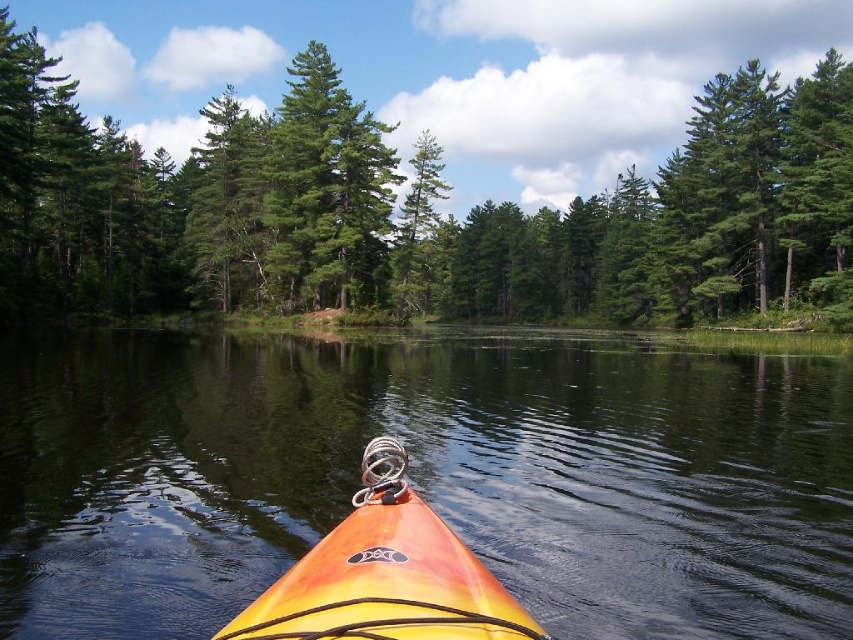
Question: Which point is closer to the camera?

Choices:
 (A) green matte tree at center
 (B) transparent water at center
 (C) orange matte kayak at center

Answer: (C)

Question: Does green matte tree at center appear over orange matte kayak at center?

Choices:
 (A) no
 (B) yes

Answer: (B)

Question: Can you confirm if transparent water at center is bigger than orange matte kayak at center?

Choices:
 (A) no
 (B) yes

Answer: (B)

Question: Does transparent water at center appear over orange matte kayak at center?

Choices:
 (A) yes
 (B) no

Answer: (B)

Question: Which of the following is the closest to the observer?

Choices:
 (A) green matte tree at center
 (B) transparent water at center
 (C) orange matte kayak at center

Answer: (C)

Question: Which is nearer to the orange matte kayak at center?

Choices:
 (A) green matte tree at center
 (B) transparent water at center

Answer: (B)